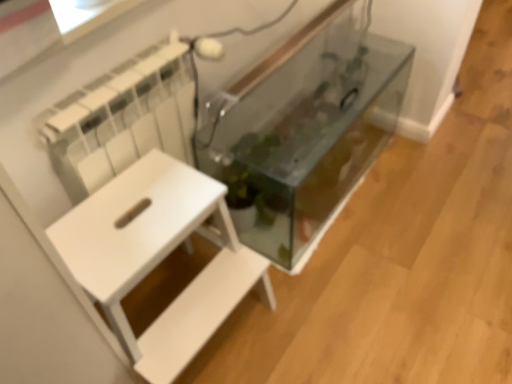
Locate an element on the screen. The height and width of the screenshot is (384, 512). vacant area that lies to the right of white matte side table at left is located at coordinates (313, 324).